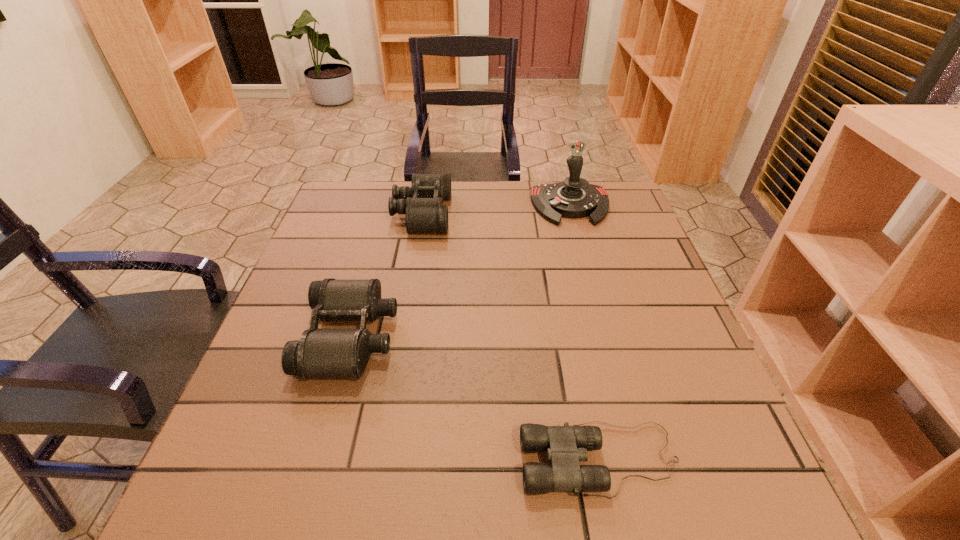
Locate an element on the screen. This screenshot has width=960, height=540. vacant space at the left edge of the desktop is located at coordinates (262, 426).

You are a GUI agent. You are given a task and a screenshot of the screen. Output one action in this format:
    pyautogui.click(x=<x>, y=<y>)
    Task: Click on the vacant space at the right edge of the desktop
    The image size is (960, 540).
    Given the screenshot: What is the action you would take?
    pyautogui.click(x=639, y=306)

The height and width of the screenshot is (540, 960). I want to click on free region at the far left corner, so click(348, 194).

Where is `free space at the far right corner of the desktop`? free space at the far right corner of the desktop is located at coordinates (616, 201).

Find the location of a particular element. This screenshot has width=960, height=540. vacant region between the rightmost binoculars and the tallest object is located at coordinates (585, 333).

Image resolution: width=960 pixels, height=540 pixels. I want to click on free spot between the farthest binoculars and the second nearest binoculars, so click(x=386, y=275).

Where is `blank region between the second nearest binoculars and the farthest binoculars`? This screenshot has height=540, width=960. blank region between the second nearest binoculars and the farthest binoculars is located at coordinates (386, 275).

Where is `vacant area that lies between the tallest object and the farthest binoculars`? vacant area that lies between the tallest object and the farthest binoculars is located at coordinates (496, 210).

The image size is (960, 540). I want to click on free point between the nearest binoculars and the second nearest object, so click(475, 399).

In order to click on unoccupied position between the nearest object and the tallest object in this screenshot , I will do `click(585, 333)`.